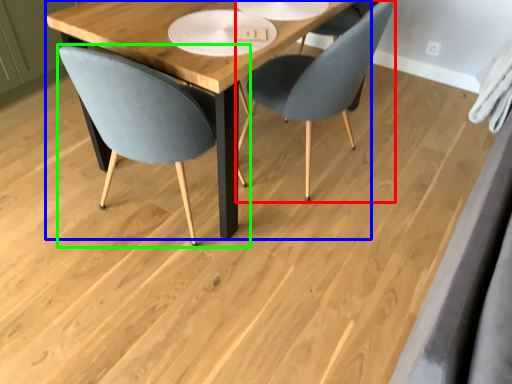
Question: Considering the real-world distances, which object is closest to chair (highlighted by a red box)? table (highlighted by a blue box) or chair (highlighted by a green box).

Choices:
 (A) table
 (B) chair

Answer: (A)